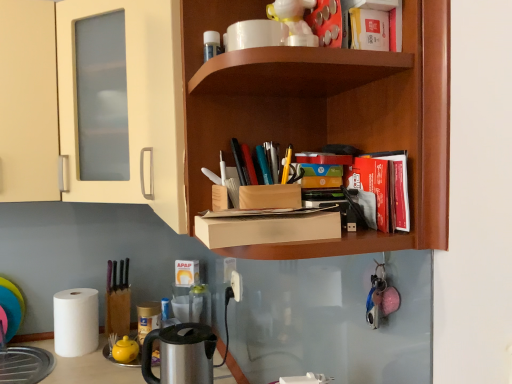
Question: From a real-world perspective, is wooden shelf at upper center above or below red matte book at upper right, placed as the 2th book when sorted from bottom to top?

Choices:
 (A) below
 (B) above

Answer: (B)

Question: Is point (316, 145) positioned closer to the camera than point (398, 178)?

Choices:
 (A) farther
 (B) closer

Answer: (A)

Question: Which object is positioned farthest from the white plastic electric outlet at lower center?

Choices:
 (A) red matte book at upper right, the first book positioned from the top
 (B) white glossy coffee cup at upper center
 (C) wooden shelf at upper center
 (D) white matte paper towel at lower left
 (E) red matte book at upper right, which is counted as the first book, starting from the bottom

Answer: (A)

Question: Which is nearer to the white plastic electric outlet at lower center?

Choices:
 (A) white matte paper towel at lower left
 (B) stainless steel kettle at lower left
 (C) wooden shelf at upper center
 (D) red matte book at upper right, which ranks as the third book in top-to-bottom order
 (E) red matte book at upper right, the first book positioned from the top

Answer: (B)